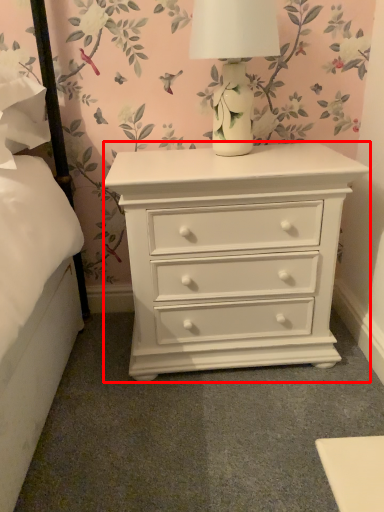
Question: From the image's perspective, what is the correct spatial relationship of nightstand (annotated by the red box) in relation to table lamp?

Choices:
 (A) above
 (B) below

Answer: (B)